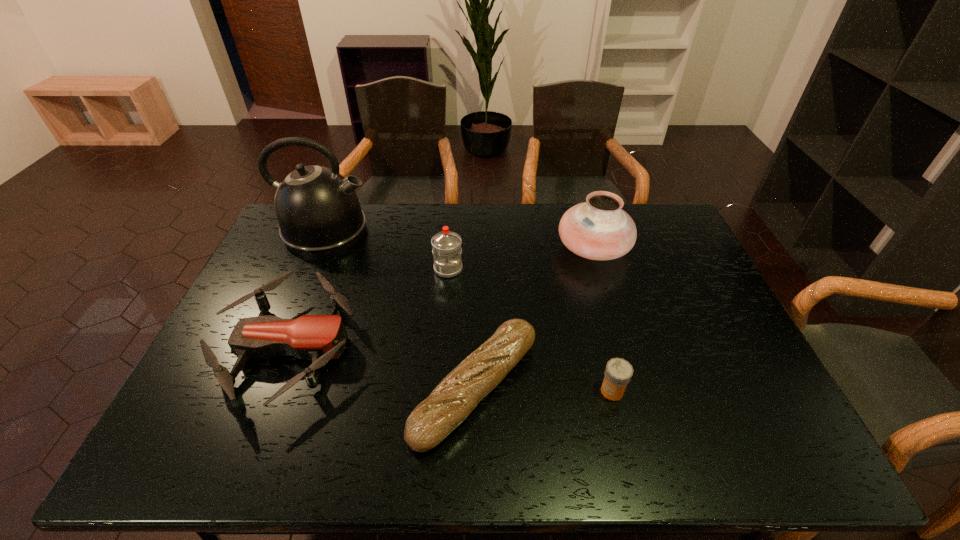
Find the location of a particular element. The image size is (960, 540). kettle is located at coordinates (318, 211).

Identify the location of pottery. (598, 229).

The image size is (960, 540). What are the coordinates of `water bottle` in the screenshot? It's located at (446, 245).

Locate an element on the screen. This screenshot has height=540, width=960. medicine is located at coordinates (618, 372).

In order to click on drone in this screenshot , I will do `click(318, 337)`.

Locate an element on the screen. The width and height of the screenshot is (960, 540). baguet is located at coordinates (457, 395).

Locate an element on the screen. vacant space located 0.080m on the spout of the tallest object is located at coordinates (394, 231).

The width and height of the screenshot is (960, 540). I want to click on free space located on the left of the pottery, so click(x=471, y=248).

The width and height of the screenshot is (960, 540). Find the location of `vacant space located 0.270m on the handle side of the third tallest object`. vacant space located 0.270m on the handle side of the third tallest object is located at coordinates (443, 347).

Image resolution: width=960 pixels, height=540 pixels. Find the location of `vacant space positioned 0.280m on the label side of the medicine`. vacant space positioned 0.280m on the label side of the medicine is located at coordinates (488, 391).